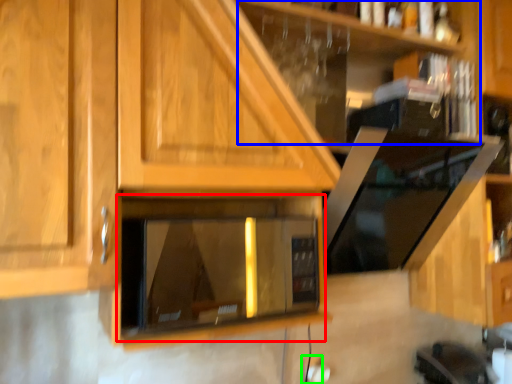
Question: Estimate the real-world distances between objects in this image. Which object is farther from appliance (highlighted by a red box), shelf (highlighted by a blue box) or electric outlet (highlighted by a green box)?

Choices:
 (A) shelf
 (B) electric outlet

Answer: (B)